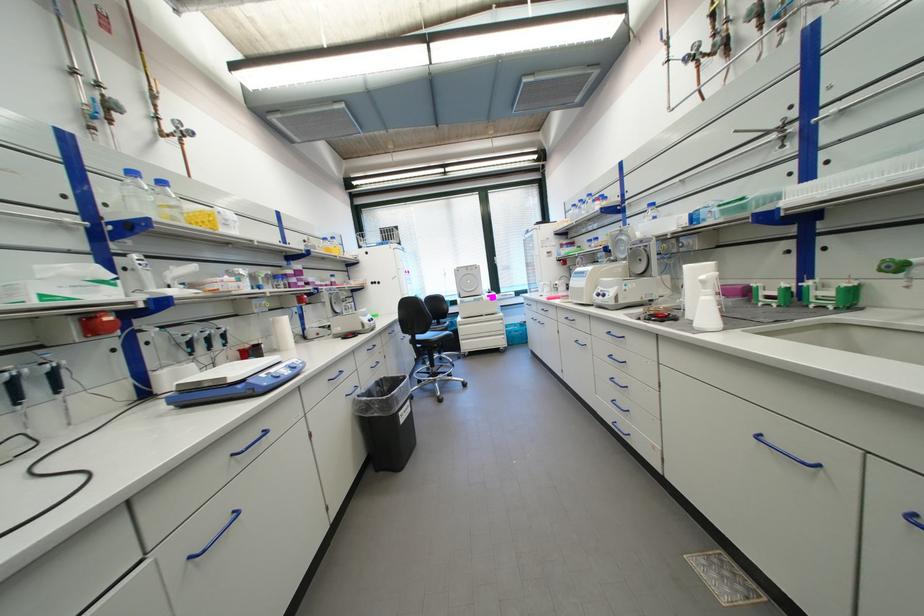
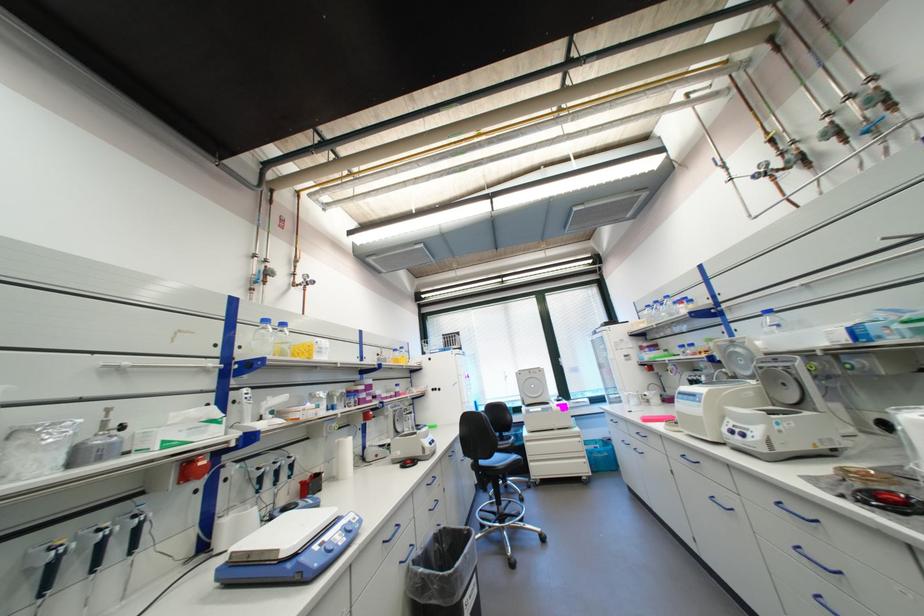
The point at (138, 180) is marked in the first image. Where is the corresponding point in the second image?

(271, 326)